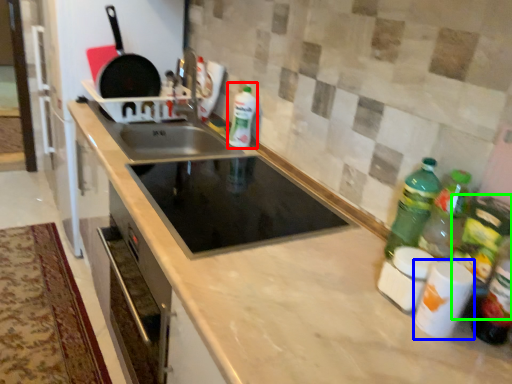
Question: Which is nearer to the bottle (highlighted by a red box)? appliance (highlighted by a blue box) or bottle (highlighted by a green box).

Choices:
 (A) appliance
 (B) bottle

Answer: (B)